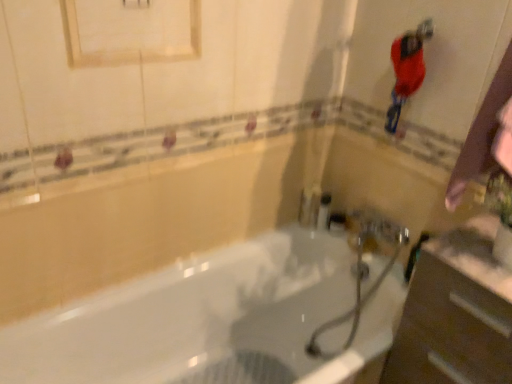
Identify the location of shiny red hairbrush at upper right. (407, 69).

Locate an element on the screen. white glossy bathtub at center is located at coordinates (194, 319).

Is point (110, 36) positioned in front of point (409, 74)?

Yes.

Considering the positions of objects white matte medicine cabinet at upper center and shiny red hairbrush at upper right in the image provided, who is more to the right, white matte medicine cabinet at upper center or shiny red hairbrush at upper right?

shiny red hairbrush at upper right.

Is white matte medicine cabinet at upper center situated inside shiny red hairbrush at upper right or outside?

white matte medicine cabinet at upper center is spatially situated outside shiny red hairbrush at upper right.

Consider the image. Does white matte medicine cabinet at upper center come behind shiny red hairbrush at upper right?

No, white matte medicine cabinet at upper center is in front of shiny red hairbrush at upper right.

Is shiny red hairbrush at upper right inside or outside of white glossy bathtub at center?

shiny red hairbrush at upper right is spatially situated outside white glossy bathtub at center.

Is shiny red hairbrush at upper right wider than white glossy bathtub at center?

In fact, shiny red hairbrush at upper right might be narrower than white glossy bathtub at center.

Which is behind, point (401, 49) or point (203, 260)?

The point (203, 260) is behind.

Between metallic silver faucet at center and shiny red hairbrush at upper right, which one has smaller size?

metallic silver faucet at center is smaller.

Choose the correct answer: Is metallic silver faucet at center inside shiny red hairbrush at upper right or outside it?

metallic silver faucet at center is located beyond the bounds of shiny red hairbrush at upper right.

Does metallic silver faucet at center have a lesser width compared to shiny red hairbrush at upper right?

Correct, the width of metallic silver faucet at center is less than that of shiny red hairbrush at upper right.

From a real-world perspective, is metallic silver faucet at center above or below shiny red hairbrush at upper right?

In terms of real-world spatial position, metallic silver faucet at center is below shiny red hairbrush at upper right.

Does white glossy bathtub at center come in front of white matte medicine cabinet at upper center?

Yes, white glossy bathtub at center is in front of white matte medicine cabinet at upper center.

Is white glossy bathtub at center turned away from white matte medicine cabinet at upper center?

white glossy bathtub at center is not turned away from white matte medicine cabinet at upper center.

How many degrees apart are the facing directions of white glossy bathtub at center and white matte medicine cabinet at upper center?

The angle between the facing direction of white glossy bathtub at center and the facing direction of white matte medicine cabinet at upper center is 0.00257 degrees.

Does white glossy bathtub at center appear on the left side of white matte medicine cabinet at upper center?

Incorrect, white glossy bathtub at center is not on the left side of white matte medicine cabinet at upper center.

Is point (144, 371) closer or farther from the camera than point (408, 45)?

Point (144, 371) is farther from the camera than point (408, 45).

The image size is (512, 384). What are the coordinates of `person on the right of white glossy bathtub at center` in the screenshot? It's located at (407, 69).

Is shiny red hairbrush at upper right at the back of white glossy bathtub at center?

No, white glossy bathtub at center is not facing away from shiny red hairbrush at upper right.

Considering the relative sizes of white matte medicine cabinet at upper center and metallic silver faucet at center in the image provided, is white matte medicine cabinet at upper center thinner than metallic silver faucet at center?

Yes, white matte medicine cabinet at upper center is thinner than metallic silver faucet at center.

Is white matte medicine cabinet at upper center taller or shorter than metallic silver faucet at center?

Considering their sizes, white matte medicine cabinet at upper center has more height than metallic silver faucet at center.

Would you say white matte medicine cabinet at upper center is to the left or to the right of metallic silver faucet at center in the picture?

white matte medicine cabinet at upper center is to the left of metallic silver faucet at center.

Is white matte medicine cabinet at upper center looking in the opposite direction of metallic silver faucet at center?

white matte medicine cabinet at upper center is not turned away from metallic silver faucet at center.

Identify the location of bathtub in front of the metallic silver faucet at center. This screenshot has width=512, height=384. (194, 319).

Which is correct: white glossy bathtub at center is inside metallic silver faucet at center, or outside of it?

white glossy bathtub at center is spatially situated outside metallic silver faucet at center.

Does white glossy bathtub at center appear on the left side of metallic silver faucet at center?

Correct, you'll find white glossy bathtub at center to the left of metallic silver faucet at center.

Could you tell me if white glossy bathtub at center is facing metallic silver faucet at center?

No, white glossy bathtub at center is not turned towards metallic silver faucet at center.

This screenshot has height=384, width=512. Find the location of `medicine cabinet on the left of shiny red hairbrush at upper right`. medicine cabinet on the left of shiny red hairbrush at upper right is located at coordinates (131, 31).

This screenshot has width=512, height=384. I want to click on person behind the white glossy bathtub at center, so click(x=407, y=69).

Consider the image. Based on their spatial positions, is metallic silver faucet at center or white matte medicine cabinet at upper center further from shiny red hairbrush at upper right?

The object further to shiny red hairbrush at upper right is white matte medicine cabinet at upper center.

Considering their positions, is white matte medicine cabinet at upper center positioned further to shiny red hairbrush at upper right than metallic silver faucet at center?

white matte medicine cabinet at upper center lies further to shiny red hairbrush at upper right than the other object.

Consider the image. Looking at the image, which one is located further to white matte medicine cabinet at upper center, metallic silver faucet at center or shiny red hairbrush at upper right?

Among the two, metallic silver faucet at center is located further to white matte medicine cabinet at upper center.

Based on their spatial positions, is white glossy bathtub at center or shiny red hairbrush at upper right further from metallic silver faucet at center?

shiny red hairbrush at upper right.

Which object lies further to the anchor point white glossy bathtub at center, metallic silver faucet at center or shiny red hairbrush at upper right?

shiny red hairbrush at upper right is further to white glossy bathtub at center.

Estimate the real-world distances between objects in this image. Which object is closer to metallic silver faucet at center, white matte medicine cabinet at upper center or shiny red hairbrush at upper right?

shiny red hairbrush at upper right.

Looking at the image, which one is located further to white matte medicine cabinet at upper center, white glossy bathtub at center or shiny red hairbrush at upper right?

white glossy bathtub at center lies further to white matte medicine cabinet at upper center than the other object.

From the image, which object appears to be nearer to white matte medicine cabinet at upper center, shiny red hairbrush at upper right or metallic silver faucet at center?

→ shiny red hairbrush at upper right.

Find the location of `person between white matte medicine cabinet at upper center and white glossy bathtub at center in the vertical direction`. person between white matte medicine cabinet at upper center and white glossy bathtub at center in the vertical direction is located at coordinates coord(407,69).

The height and width of the screenshot is (384, 512). In order to click on toiletry between shiny red hairbrush at upper right and white glossy bathtub at center vertically in this screenshot , I will do `click(324, 211)`.

Where is `toiletry situated between white matte medicine cabinet at upper center and shiny red hairbrush at upper right from left to right`? toiletry situated between white matte medicine cabinet at upper center and shiny red hairbrush at upper right from left to right is located at coordinates (324, 211).

The height and width of the screenshot is (384, 512). Identify the location of toiletry between white matte medicine cabinet at upper center and white glossy bathtub at center in the up-down direction. (324, 211).